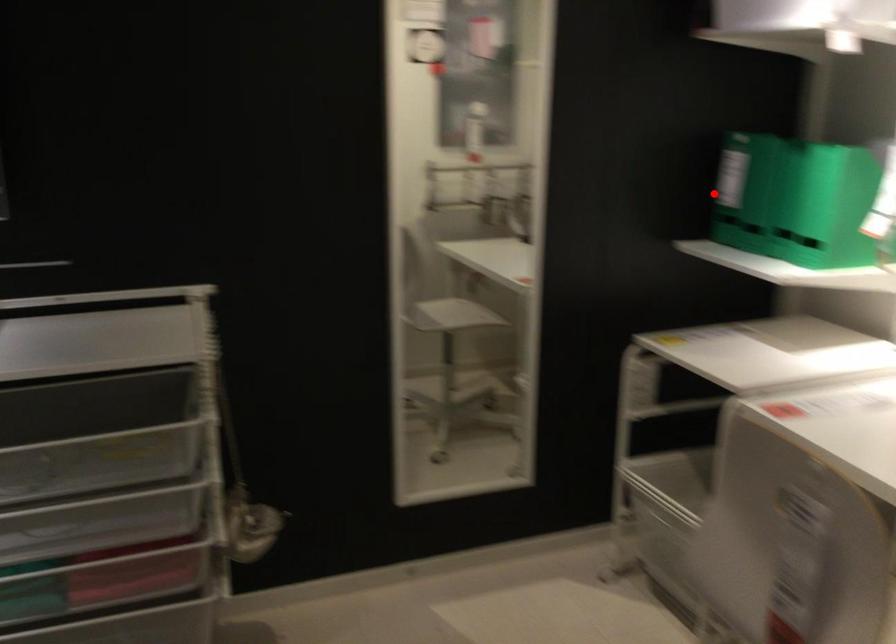
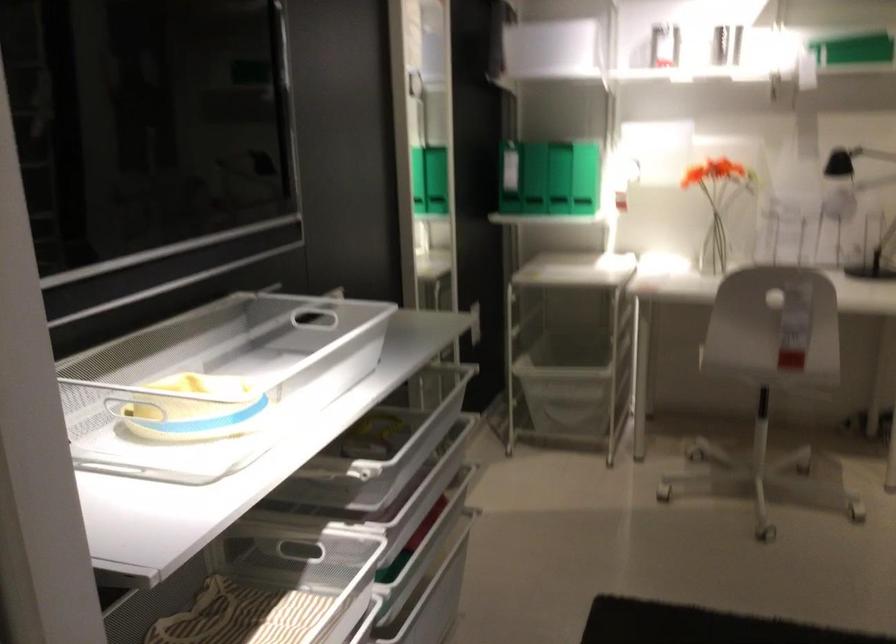
Where in the second image is the point corresponding to the highlighted location from the first image?

(511, 174)